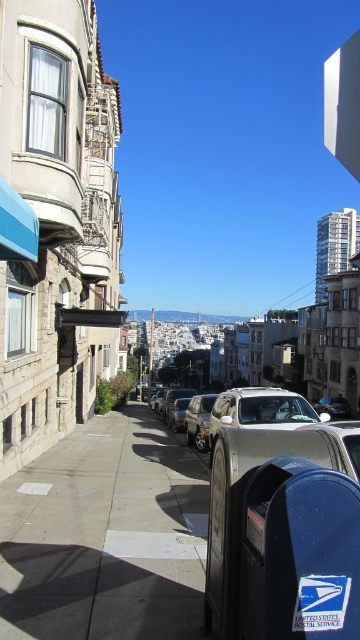
You are a delivery driver who needs to park your vehicle between the two cars in the image. The satin silver suv at center and the metallic silver car at center are both parked on the street. Which vehicle takes up more space on the road?

The satin silver suv at center is wider than the metallic silver car at center, so it takes up more space on the road.

You are a delivery driver trying to navigate through the street in the image. You see a satin silver SUV at center and a metallic silver car at center. Which vehicle should you avoid hitting if you are driving uphill?

You should avoid hitting the satin silver SUV at center because it is above the metallic silver car at center on the slope, meaning it is closer to you as you drive uphill.